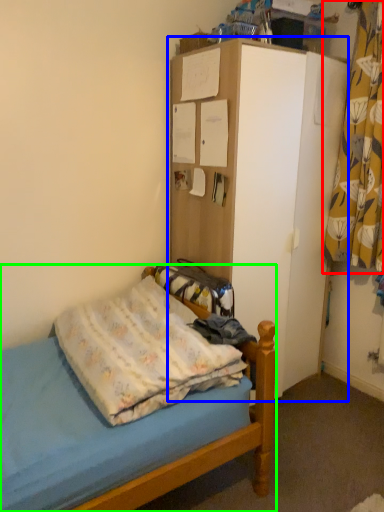
Question: Based on their relative distances, which object is nearer to curtain (highlighted by a red box)? Choose from dresser (highlighted by a blue box) and bed (highlighted by a green box).

Choices:
 (A) dresser
 (B) bed

Answer: (A)